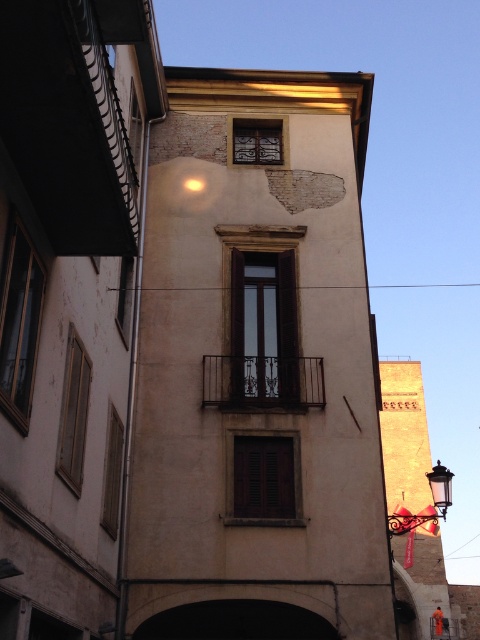
Does polished brass lantern at lower right appear on the left side of metallic glass lantern at lower right?

Yes, polished brass lantern at lower right is to the left of metallic glass lantern at lower right.

Is polished brass lantern at lower right taller than metallic glass lantern at lower right?

Indeed, polished brass lantern at lower right has a greater height compared to metallic glass lantern at lower right.

The height and width of the screenshot is (640, 480). What do you see at coordinates (432, 500) in the screenshot?
I see `polished brass lantern at lower right` at bounding box center [432, 500].

The image size is (480, 640). Find the location of `polished brass lantern at lower right`. polished brass lantern at lower right is located at coordinates (432, 500).